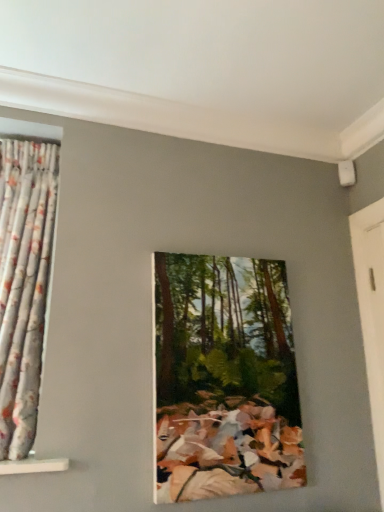
The width and height of the screenshot is (384, 512). What do you see at coordinates (372, 313) in the screenshot?
I see `white wooden door at right` at bounding box center [372, 313].

In order to click on floral fabric curtain at left in this screenshot , I will do `click(24, 284)`.

Is oil painting of forest at center facing towards white wooden door at right?

No, oil painting of forest at center is not oriented towards white wooden door at right.

What are the coordinates of `oil painting that appears on the left of white wooden door at right` in the screenshot? It's located at (225, 379).

Is oil painting of forest at center in front of or behind white wooden door at right in the image?

oil painting of forest at center is positioned closer to the viewer than white wooden door at right.

Looking at this image, how different are the orientations of oil painting of forest at center and white wooden door at right in degrees?

90 degrees separate the facing orientations of oil painting of forest at center and white wooden door at right.

Considering the relative sizes of floral fabric curtain at left and white wooden door at right in the image provided, is floral fabric curtain at left thinner than white wooden door at right?

No.

From the image's perspective, between floral fabric curtain at left and white wooden door at right, which one is located above?

floral fabric curtain at left appears higher in the image.

Is floral fabric curtain at left aimed at oil painting of forest at center?

No, floral fabric curtain at left is not facing towards oil painting of forest at center.

From the image's perspective, is floral fabric curtain at left located above or below oil painting of forest at center?

Based on their image positions, floral fabric curtain at left is located above oil painting of forest at center.

Does floral fabric curtain at left have a lesser height compared to oil painting of forest at center?

No, floral fabric curtain at left is not shorter than oil painting of forest at center.

From a real-world perspective, does floral fabric curtain at left stand above oil painting of forest at center?

Yes, from a real-world perspective, floral fabric curtain at left is on top of oil painting of forest at center.

Considering the positions of objects white wooden door at right and floral fabric curtain at left in the image provided, who is more to the right, white wooden door at right or floral fabric curtain at left?

white wooden door at right is more to the right.

Considering their positions, is white wooden door at right located in front of or behind floral fabric curtain at left?

white wooden door at right is positioned farther from the viewer than floral fabric curtain at left.

Consider the image. From a real-world perspective, which object rests below the other?

From a 3D spatial view, white wooden door at right is below.

From their relative heights in the image, would you say oil painting of forest at center is taller or shorter than floral fabric curtain at left?

Clearly, oil painting of forest at center is shorter compared to floral fabric curtain at left.

Locate an element on the screen. This screenshot has height=512, width=384. curtain that is in front of the oil painting of forest at center is located at coordinates (24, 284).

Is oil painting of forest at center outside of floral fabric curtain at left?

Yes, oil painting of forest at center is outside of floral fabric curtain at left.

Is point (157, 482) less distant than point (34, 410)?

No, it is behind (34, 410).

What's the angular difference between white wooden door at right and oil painting of forest at center's facing directions?

white wooden door at right and oil painting of forest at center are facing 90 degrees away from each other.

Where is `oil painting that is in front of the white wooden door at right`? This screenshot has width=384, height=512. oil painting that is in front of the white wooden door at right is located at coordinates (225, 379).

Consider the image. From a real-world perspective, is white wooden door at right on oil painting of forest at center?

Yes.

Where is `oil painting on the left of white wooden door at right`? The image size is (384, 512). oil painting on the left of white wooden door at right is located at coordinates (225, 379).

Locate an element on the screen. door behind the floral fabric curtain at left is located at coordinates (372, 313).

Looking at the image, which one is located further to white wooden door at right, oil painting of forest at center or floral fabric curtain at left?

floral fabric curtain at left is further to white wooden door at right.

Considering their positions, is white wooden door at right positioned closer to floral fabric curtain at left than oil painting of forest at center?

oil painting of forest at center.

From the image, which object appears to be farther from floral fabric curtain at left, oil painting of forest at center or white wooden door at right?

white wooden door at right lies further to floral fabric curtain at left than the other object.

From the image, which object appears to be farther from white wooden door at right, floral fabric curtain at left or oil painting of forest at center?

floral fabric curtain at left is positioned further to the anchor white wooden door at right.

Looking at the image, which one is located closer to oil painting of forest at center, white wooden door at right or floral fabric curtain at left?

Based on the image, floral fabric curtain at left appears to be nearer to oil painting of forest at center.

Estimate the real-world distances between objects in this image. Which object is closer to oil painting of forest at center, floral fabric curtain at left or white wooden door at right?

Based on the image, floral fabric curtain at left appears to be nearer to oil painting of forest at center.

Locate an element on the screen. oil painting between floral fabric curtain at left and white wooden door at right in the horizontal direction is located at coordinates (225, 379).